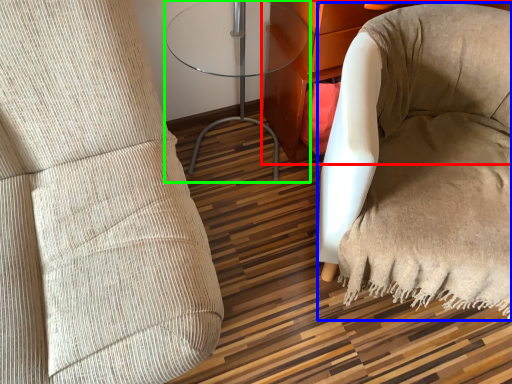
Question: Which object is the farthest from furniture (highlighted by a red box)? Choose among these: bean bag chair (highlighted by a blue box) or table (highlighted by a green box).

Choices:
 (A) bean bag chair
 (B) table

Answer: (A)